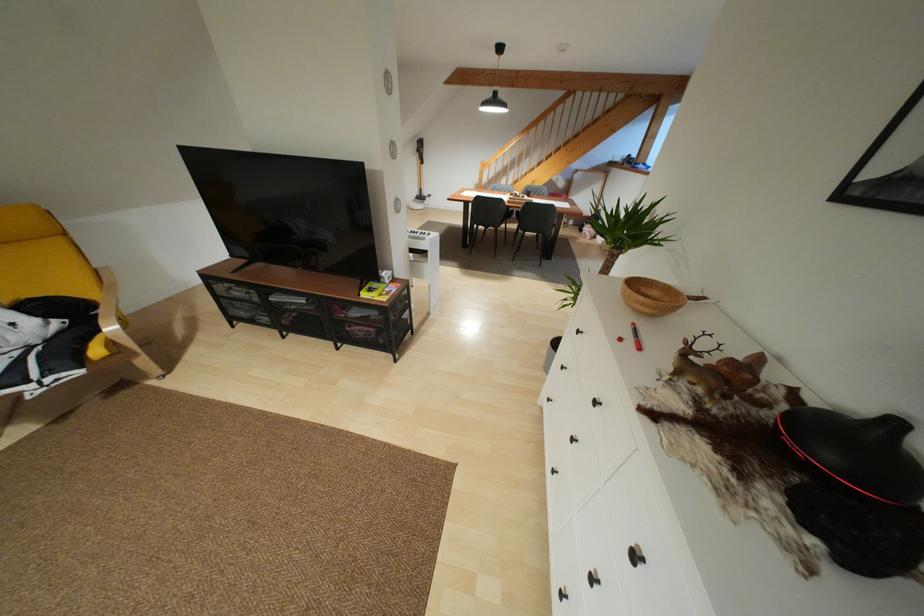
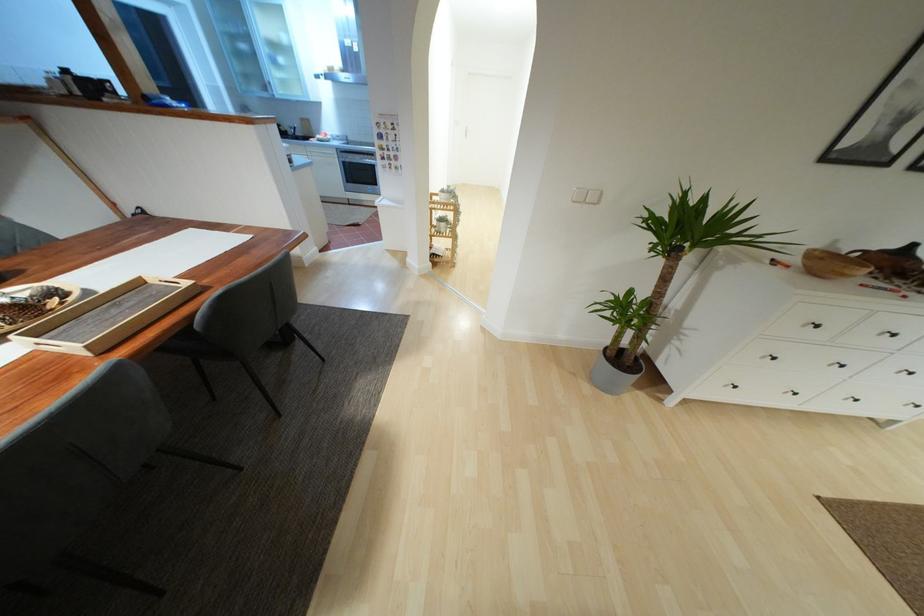
Where in the second image is the point corresponding to (x=562, y=367) from the first image?

(773, 358)